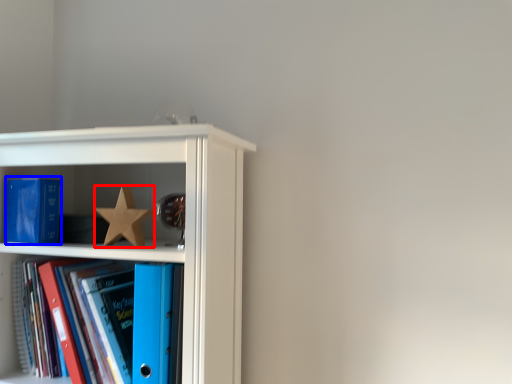
Question: Which of the following is the closest to the observer, star (highlighted by a red box) or paperback book (highlighted by a blue box)?

Choices:
 (A) star
 (B) paperback book

Answer: (A)